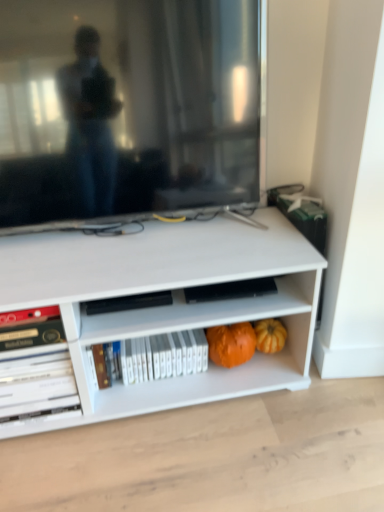
Find the location of a particular element. white glossy book at lower left, the first book from the left is located at coordinates (35, 366).

Find the location of a particular element. white glossy bookshelf at center, the first book positioned from the right is located at coordinates (158, 356).

You are a GUI agent. You are given a task and a screenshot of the screen. Output one action in this format:
    pyautogui.click(x=<x>, y=<y>)
    Task: Click on the white glossy book at lower left, marked as the second book in a right-to-left arrangement
    
    Given the screenshot: What is the action you would take?
    pyautogui.click(x=35, y=366)

Considering the relative sizes of white glossy book at lower left, marked as the second book in a right-to-left arrangement, and orange matte pumpkin at lower right, placed as the 2th pumpkin when sorted from left to right, in the image provided, is white glossy book at lower left, marked as the second book in a right-to-left arrangement, shorter than orange matte pumpkin at lower right, placed as the 2th pumpkin when sorted from left to right,?

Incorrect, the height of white glossy book at lower left, marked as the second book in a right-to-left arrangement, does not fall short of that of orange matte pumpkin at lower right, placed as the 2th pumpkin when sorted from left to right.

From the image's perspective, is white glossy book at lower left, the first book from the left, located above orange matte pumpkin at lower right, placed as the 2th pumpkin when sorted from left to right?

No, from the image's perspective, white glossy book at lower left, the first book from the left, is not on top of orange matte pumpkin at lower right, placed as the 2th pumpkin when sorted from left to right.

From a real-world perspective, which object rests below the other?

orange matte pumpkin at lower right, placed as the 1th pumpkin when sorted from right to left, is physically lower.

Is white glossy book at lower left, the first book from the left, outside of orange matte pumpkin at lower right, placed as the 2th pumpkin when sorted from left to right?

That's correct, white glossy book at lower left, the first book from the left, is outside of orange matte pumpkin at lower right, placed as the 2th pumpkin when sorted from left to right.

Considering the sizes of objects matte black television at upper center and orange matte pumpkin at lower right, placed as the 1th pumpkin when sorted from right to left, in the image provided, who is thinner, matte black television at upper center or orange matte pumpkin at lower right, placed as the 1th pumpkin when sorted from right to left,?

Thinner between the two is orange matte pumpkin at lower right, placed as the 1th pumpkin when sorted from right to left.

Starting from the matte black television at upper center, which pumpkin is the 2nd one to the right? Please provide its 2D coordinates.

[(270, 335)]

Does matte black television at upper center appear on the right side of orange matte pumpkin at lower right, placed as the 1th pumpkin when sorted from right to left?

In fact, matte black television at upper center is to the left of orange matte pumpkin at lower right, placed as the 1th pumpkin when sorted from right to left.

In the image, is matte black television at upper center positioned in front of or behind orange matte pumpkin at lower right, placed as the 1th pumpkin when sorted from right to left?

In the image, matte black television at upper center appears in front of orange matte pumpkin at lower right, placed as the 1th pumpkin when sorted from right to left.

Which of these two, orange matte pumpkin at lower right, placed as the 1th pumpkin when sorted from right to left, or matte black television at upper center, is thinner?

orange matte pumpkin at lower right, placed as the 1th pumpkin when sorted from right to left.

Based on their sizes in the image, would you say orange matte pumpkin at lower right, placed as the 2th pumpkin when sorted from left to right, is bigger or smaller than matte black television at upper center?

orange matte pumpkin at lower right, placed as the 2th pumpkin when sorted from left to right, is smaller than matte black television at upper center.

Does point (273, 332) come in front of point (218, 16)?

No, (273, 332) is further to viewer.

Is orange matte pumpkin at lower right, placed as the 2th pumpkin when sorted from left to right, far from matte black television at upper center?

orange matte pumpkin at lower right, placed as the 2th pumpkin when sorted from left to right, is actually quite close to matte black television at upper center.

From the image's perspective, which one is positioned lower, matte black television at upper center or white glossy book at lower left, the first book from the left?

white glossy book at lower left, the first book from the left, appears lower in the image.

Is matte black television at upper center wider than white glossy book at lower left, marked as the second book in a right-to-left arrangement?

No, matte black television at upper center is not wider than white glossy book at lower left, marked as the second book in a right-to-left arrangement.

Visually, is matte black television at upper center positioned to the left or to the right of white glossy book at lower left, marked as the second book in a right-to-left arrangement?

matte black television at upper center is to the right of white glossy book at lower left, marked as the second book in a right-to-left arrangement.

Looking at this image, which is behind, matte black television at upper center or white glossy book at lower left, marked as the second book in a right-to-left arrangement?

Positioned behind is white glossy book at lower left, marked as the second book in a right-to-left arrangement.

What are the coordinates of `pumpkin below the orange matte pumpkin at lower center, which is the first pumpkin in left-to-right order (from the image's perspective)` in the screenshot? It's located at (270, 335).

From the image's perspective, is orange matte pumpkin at lower center, the second pumpkin viewed from the right, located above or below orange matte pumpkin at lower right, placed as the 1th pumpkin when sorted from right to left?

Clearly, from the image's perspective, orange matte pumpkin at lower center, the second pumpkin viewed from the right, is above orange matte pumpkin at lower right, placed as the 1th pumpkin when sorted from right to left.

In the scene shown: From a real-world perspective, is orange matte pumpkin at lower center, the second pumpkin viewed from the right, physically located above or below orange matte pumpkin at lower right, placed as the 2th pumpkin when sorted from left to right?

From a real-world perspective, orange matte pumpkin at lower center, the second pumpkin viewed from the right, is physically above orange matte pumpkin at lower right, placed as the 2th pumpkin when sorted from left to right.

Is orange matte pumpkin at lower right, placed as the 1th pumpkin when sorted from right to left, surrounded by orange matte pumpkin at lower center, the second pumpkin viewed from the right?

That's incorrect, orange matte pumpkin at lower right, placed as the 1th pumpkin when sorted from right to left, is not inside orange matte pumpkin at lower center, the second pumpkin viewed from the right.

Is point (280, 343) positioned after point (169, 346)?

Yes.

Can you tell me how much orange matte pumpkin at lower right, placed as the 1th pumpkin when sorted from right to left, and white glossy bookshelf at center, which is counted as the second book, starting from the left, differ in facing direction?

The facing directions of orange matte pumpkin at lower right, placed as the 1th pumpkin when sorted from right to left, and white glossy bookshelf at center, which is counted as the second book, starting from the left, are 0.932 degrees apart.

From a real-world perspective, is orange matte pumpkin at lower right, placed as the 1th pumpkin when sorted from right to left, located higher than white glossy bookshelf at center, the first book positioned from the right?

No, from a real-world perspective, orange matte pumpkin at lower right, placed as the 1th pumpkin when sorted from right to left, is not above white glossy bookshelf at center, the first book positioned from the right.

Which pumpkin is the 1st one when counting from the right side of the white glossy bookshelf at center, which is counted as the second book, starting from the left? Please provide its 2D coordinates.

[(231, 344)]

Is orange matte pumpkin at lower center, the second pumpkin viewed from the right, touching white glossy bookshelf at center, the first book positioned from the right?

No.

Is orange matte pumpkin at lower center, which is the first pumpkin in left-to-right order, wider than white glossy bookshelf at center, the first book positioned from the right?

No.

From a real-world perspective, starting from the white glossy book at lower left, marked as the second book in a right-to-left arrangement, which pumpkin is the 2nd one below it? Please provide its 2D coordinates.

[(270, 335)]

At what (x,y) coordinates should I click in order to perform the action: click on the 2nd pumpkin positioned below the matte black television at upper center (from the image's perspective). Please return your answer as a coordinate pair (x, y). Looking at the image, I should click on tap(270, 335).

Looking at the image, which one is located further to orange matte pumpkin at lower center, the second pumpkin viewed from the right, orange matte pumpkin at lower right, placed as the 1th pumpkin when sorted from right to left, or white glossy book at lower left, marked as the second book in a right-to-left arrangement?

white glossy book at lower left, marked as the second book in a right-to-left arrangement, is positioned further to the anchor orange matte pumpkin at lower center, the second pumpkin viewed from the right.

Estimate the real-world distances between objects in this image. Which object is further from matte black television at upper center, white glossy book at lower left, the first book from the left, or orange matte pumpkin at lower right, placed as the 2th pumpkin when sorted from left to right?

Among the two, orange matte pumpkin at lower right, placed as the 2th pumpkin when sorted from left to right, is located further to matte black television at upper center.

Considering their positions, is orange matte pumpkin at lower center, the second pumpkin viewed from the right, positioned closer to white glossy bookshelf at center, the first book positioned from the right, than matte black television at upper center?

orange matte pumpkin at lower center, the second pumpkin viewed from the right, is closer to white glossy bookshelf at center, the first book positioned from the right.

From the picture: Estimate the real-world distances between objects in this image. Which object is further from matte black television at upper center, orange matte pumpkin at lower center, the second pumpkin viewed from the right, or orange matte pumpkin at lower right, placed as the 2th pumpkin when sorted from left to right?

orange matte pumpkin at lower right, placed as the 2th pumpkin when sorted from left to right, lies further to matte black television at upper center than the other object.

Looking at the image, which one is located closer to matte black television at upper center, white glossy book at lower left, the first book from the left, or orange matte pumpkin at lower center, which is the first pumpkin in left-to-right order?

white glossy book at lower left, the first book from the left.

Based on their spatial positions, is orange matte pumpkin at lower center, the second pumpkin viewed from the right, or white glossy book at lower left, the first book from the left, further from white glossy bookshelf at center, which is counted as the second book, starting from the left?

white glossy book at lower left, the first book from the left, is positioned further to the anchor white glossy bookshelf at center, which is counted as the second book, starting from the left.

Estimate the real-world distances between objects in this image. Which object is further from white glossy bookshelf at center, the first book positioned from the right, white glossy book at lower left, the first book from the left, or orange matte pumpkin at lower center, which is the first pumpkin in left-to-right order?

white glossy book at lower left, the first book from the left, is further to white glossy bookshelf at center, the first book positioned from the right.

Looking at the image, which one is located further to orange matte pumpkin at lower center, which is the first pumpkin in left-to-right order, white glossy book at lower left, marked as the second book in a right-to-left arrangement, or white glossy bookshelf at center, the first book positioned from the right?

Based on the image, white glossy book at lower left, marked as the second book in a right-to-left arrangement, appears to be further to orange matte pumpkin at lower center, which is the first pumpkin in left-to-right order.

Find the location of `book between matte black television at upper center and white glossy book at lower left, marked as the second book in a right-to-left arrangement, vertically`. book between matte black television at upper center and white glossy book at lower left, marked as the second book in a right-to-left arrangement, vertically is located at coordinates (158, 356).

Image resolution: width=384 pixels, height=512 pixels. In order to click on pumpkin between white glossy bookshelf at center, which is counted as the second book, starting from the left, and orange matte pumpkin at lower right, placed as the 1th pumpkin when sorted from right to left, in the horizontal direction in this screenshot , I will do `click(231, 344)`.

You are a GUI agent. You are given a task and a screenshot of the screen. Output one action in this format:
    pyautogui.click(x=<x>, y=<y>)
    Task: Click on the book between white glossy book at lower left, the first book from the left, and orange matte pumpkin at lower right, placed as the 2th pumpkin when sorted from left to right
    
    Given the screenshot: What is the action you would take?
    pyautogui.click(x=158, y=356)

At what (x,y) coordinates should I click in order to perform the action: click on book located between white glossy book at lower left, the first book from the left, and orange matte pumpkin at lower center, the second pumpkin viewed from the right, in the left-right direction. Please return your answer as a coordinate pair (x, y). The image size is (384, 512). Looking at the image, I should click on (158, 356).